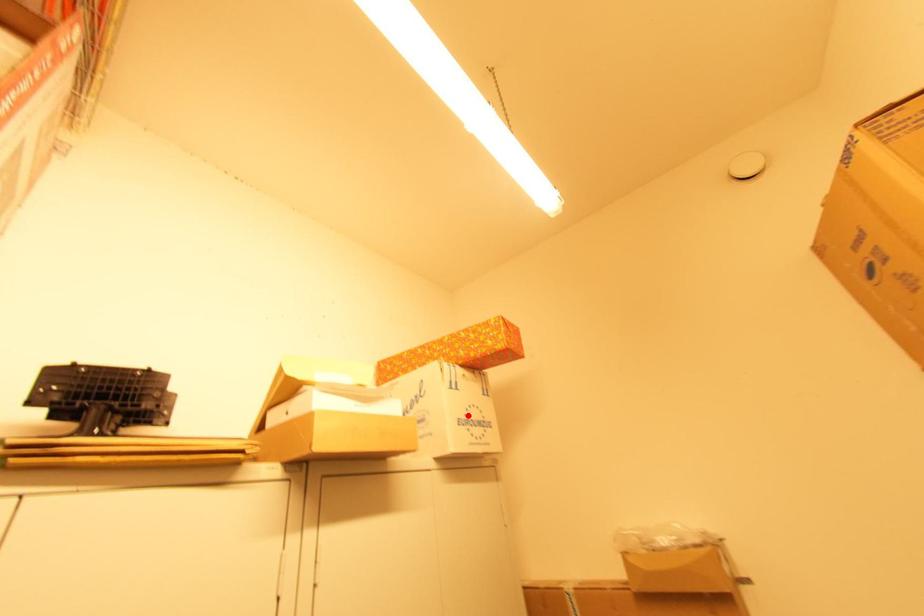
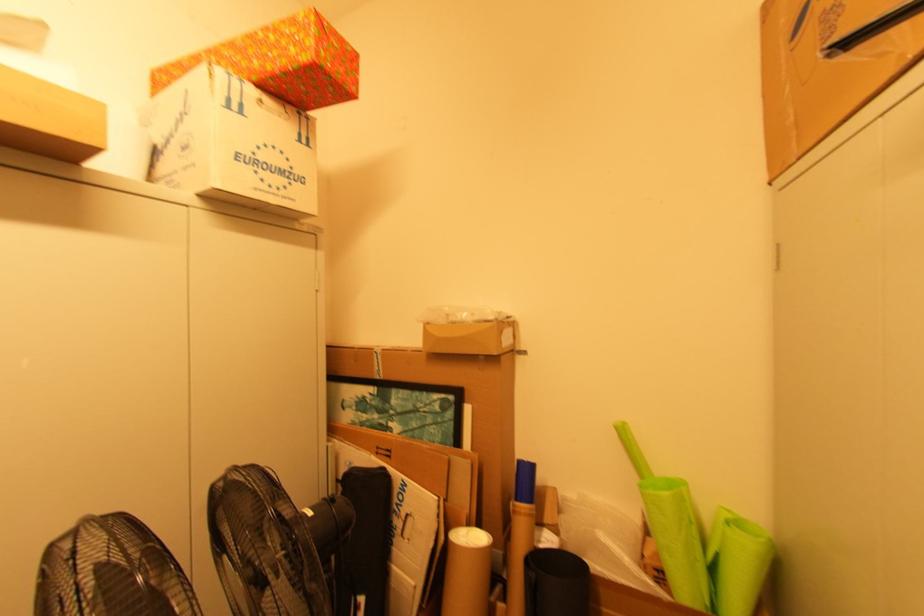
Question: I am providing you with two images of the same scene from different viewpoints. A red point is marked on the first image. Is the red point's position out of view in image 2?

Choices:
 (A) Yes
 (B) No

Answer: (B)